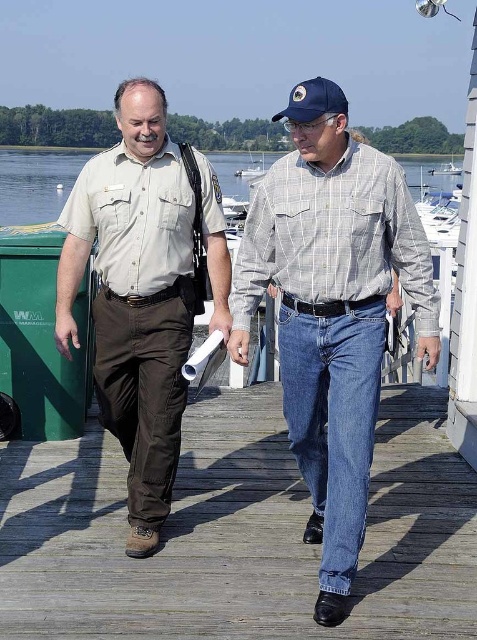
You are a photographer standing at the end of the dock. You want to take a photo of the two men walking side by side along the wooden dock. The clear water at center is between them. How far apart are the two men in the photo?

The two men are 22.99 meters apart in the photo.

You are a photographer standing at the point marked by the coordinates point (x=35, y=182). You want to take a photo of the two men walking along the dock. Since the point is marked as clear water at center, will you be able to capture both men in your photo without any obstructions from the water?

The point marked as clear water at center is at coordinates point (x=35, y=182). Since the men are walking along the wooden dock, which is above the water, their positions would be on the dock, not submerged in the water. Therefore, you can capture both men in your photo without any obstructions from the water.